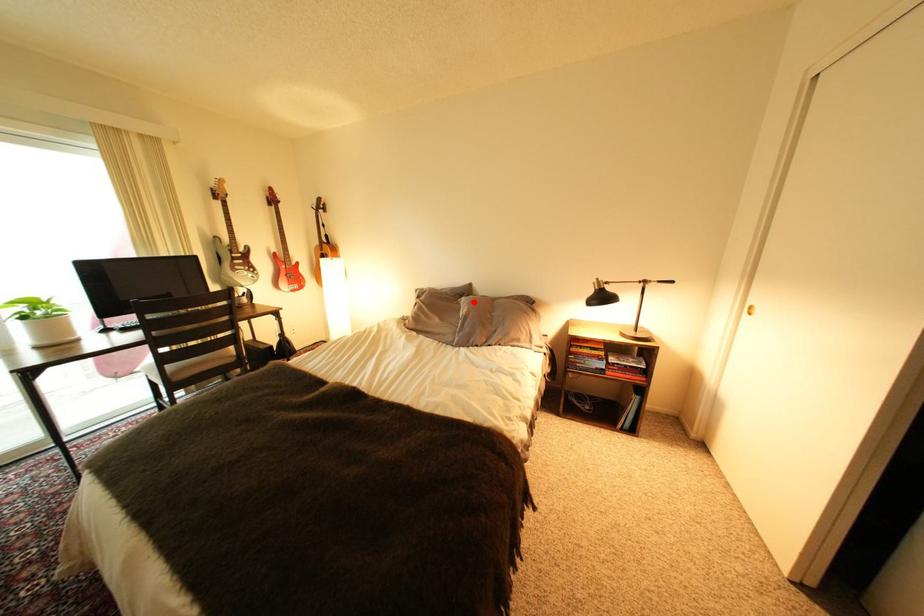
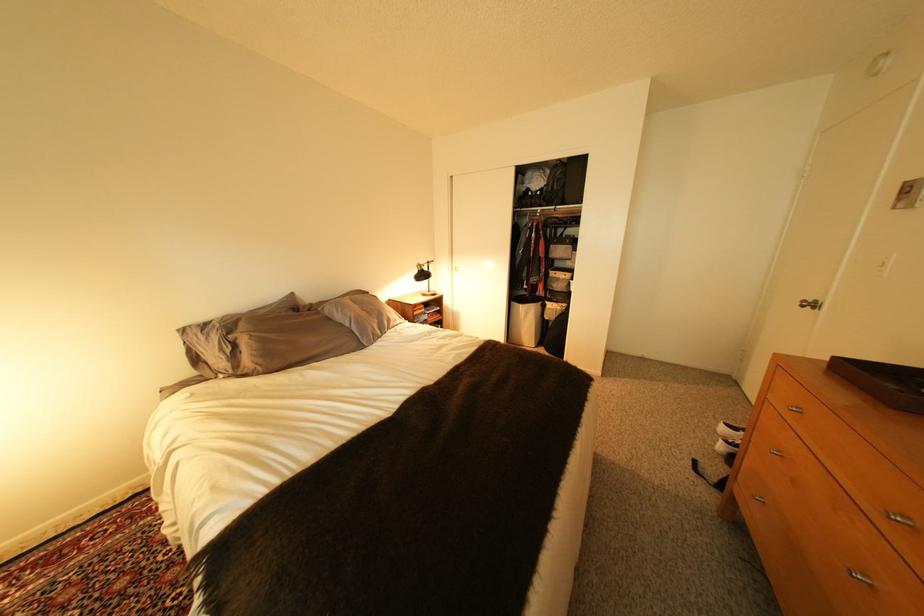
In the second image, find the point that corresponds to the highlighted location in the first image.

(335, 310)